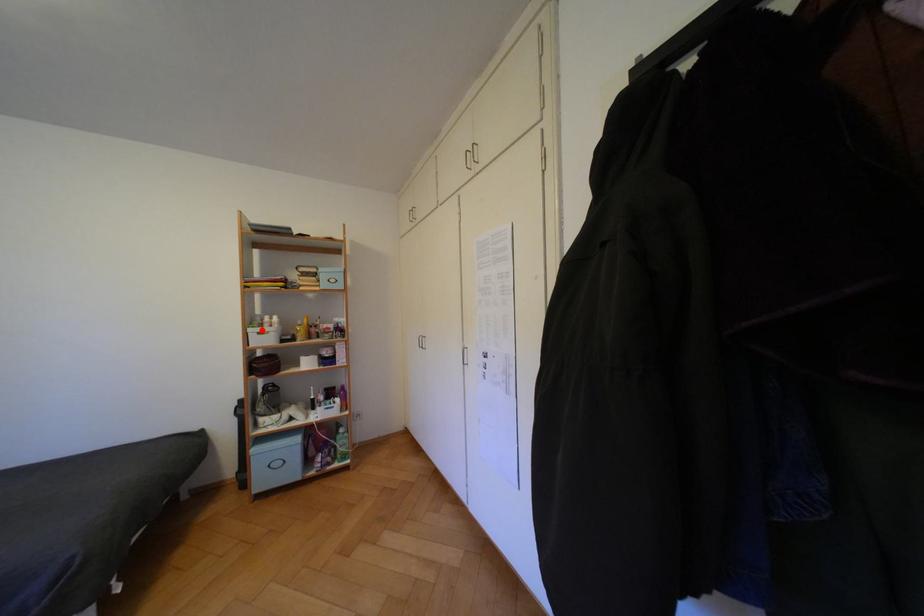
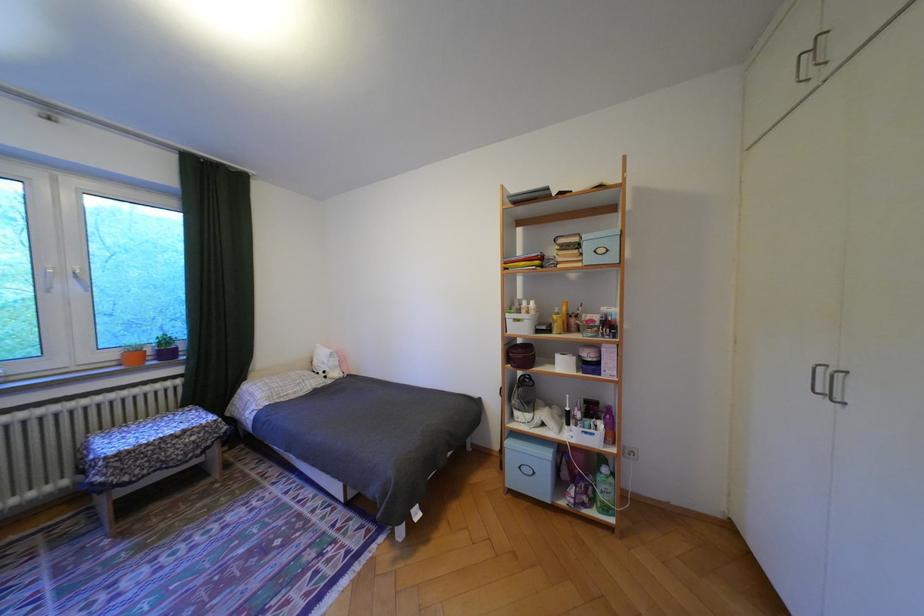
Find the pixel in the second image that matches the highlighted location in the first image.

(518, 315)